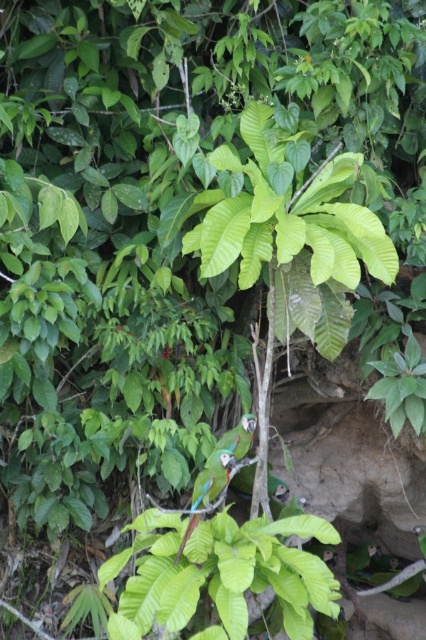
Question: Can you confirm if green glossy parrot at center is positioned above shiny green parrot at center?

Choices:
 (A) no
 (B) yes

Answer: (B)

Question: Is green glossy parrot at center to the right of shiny green parrot at center from the viewer's perspective?

Choices:
 (A) no
 (B) yes

Answer: (B)

Question: Is green glossy parrot at center in front of shiny green parrot at center?

Choices:
 (A) yes
 (B) no

Answer: (B)

Question: Which point is closer to the camera taking this photo?

Choices:
 (A) (221, 456)
 (B) (235, 449)

Answer: (A)

Question: Which object appears farthest from the camera in this image?

Choices:
 (A) shiny green parrot at center
 (B) green glossy parrot at center

Answer: (B)